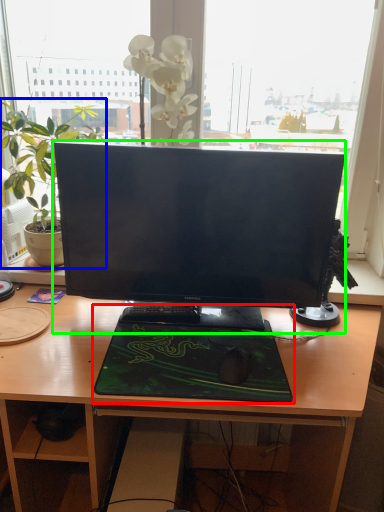
Question: Based on their relative distances, which object is farther from desktop (highlighted by a red box)? Choose from houseplant (highlighted by a blue box) and computer monitor (highlighted by a green box).

Choices:
 (A) houseplant
 (B) computer monitor

Answer: (A)